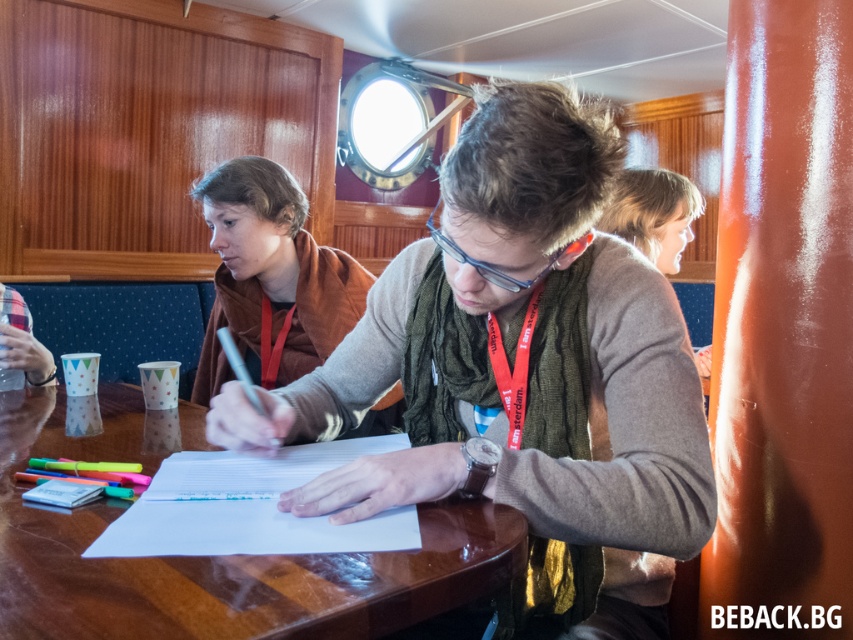
You are a guest in this room and want to put your belongings on the nearest available surface. You have a green sweater at center and a brown leather jacket at upper left. Which item is closer to the floor?

The green sweater at center is closer to the floor since it is positioned below the brown leather jacket at upper left.